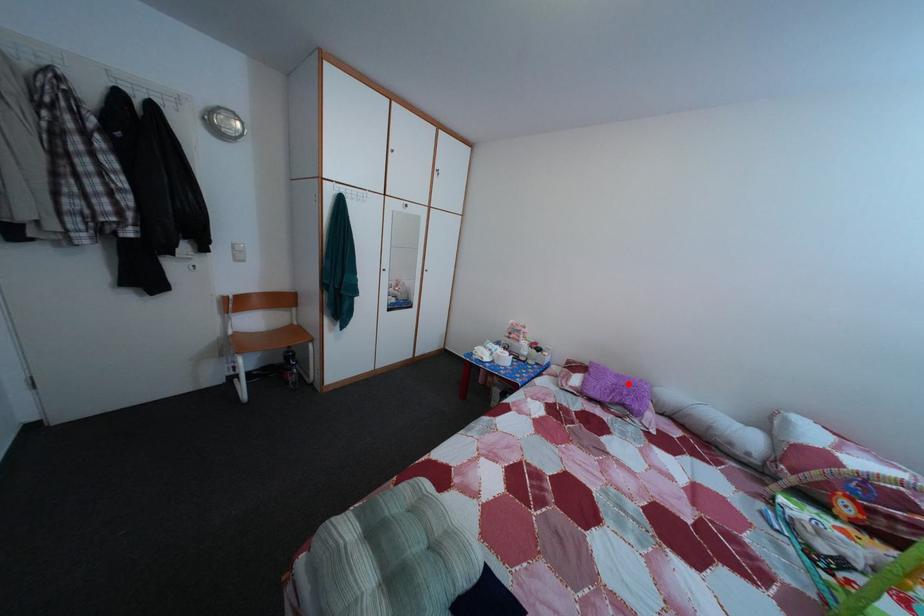
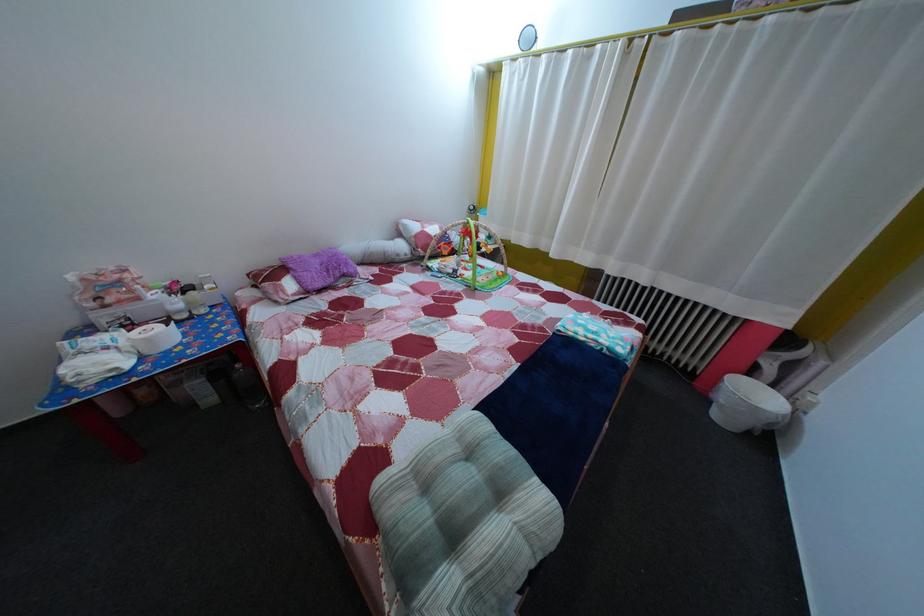
Locate, in the second image, the point that corresponds to the highlighted location in the first image.

(325, 262)